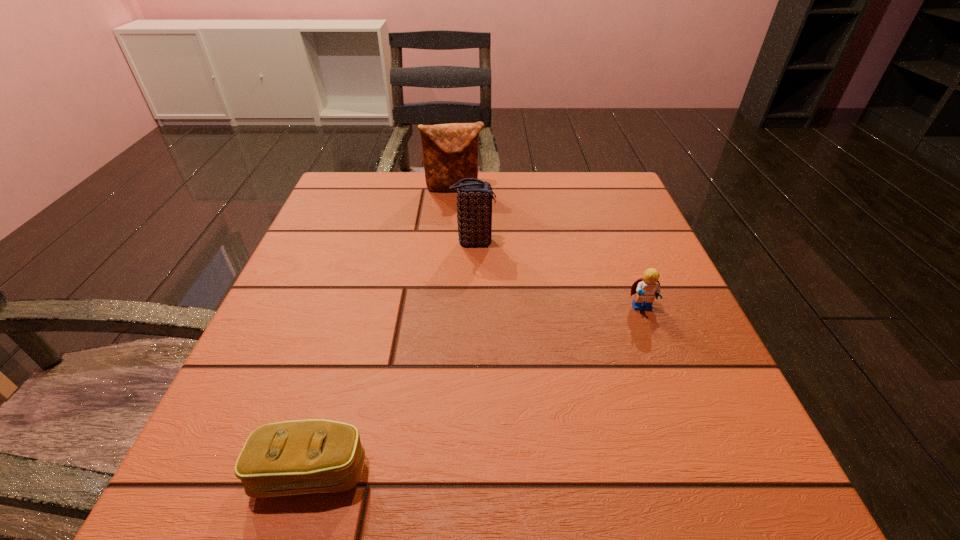
Identify the location of the farthest clutch bag. The width and height of the screenshot is (960, 540). (450, 151).

Locate an element on the screen. This screenshot has height=540, width=960. the second nearest clutch bag is located at coordinates (474, 199).

Locate an element on the screen. the second shortest object is located at coordinates (646, 289).

This screenshot has height=540, width=960. Find the location of `the rightmost object`. the rightmost object is located at coordinates (646, 289).

Where is `the shortest clutch bag`? the shortest clutch bag is located at coordinates (295, 457).

Identify the location of the shortest object. (295, 457).

I want to click on vacant area situated 0.150m on the open side of the farthest object, so click(450, 232).

Where is `free space located with the zip open on the second nearest clutch bag`? free space located with the zip open on the second nearest clutch bag is located at coordinates [x=533, y=242].

Find the location of a particular element. This screenshot has width=960, height=540. free space located 0.250m on the front-facing side of the Lego is located at coordinates (700, 456).

In order to click on object that is at the far edge in this screenshot , I will do `click(450, 151)`.